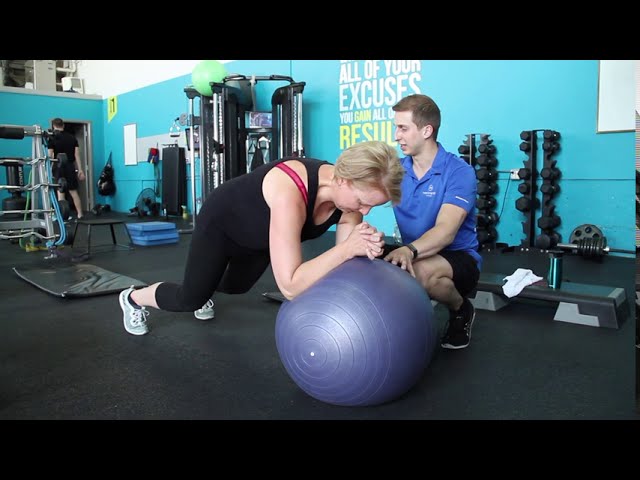
This screenshot has height=480, width=640. What are the coordinates of `teal walls` in the screenshot? It's located at (508, 95), (80, 115), (153, 114).